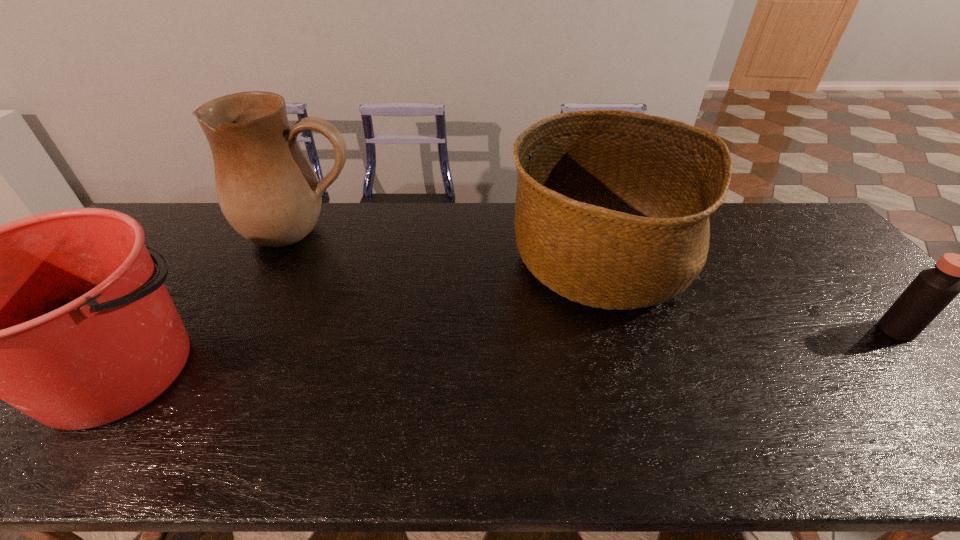
Where is `vacant region at the far edge`? This screenshot has height=540, width=960. vacant region at the far edge is located at coordinates (511, 207).

Find the location of a particular element. vacant space at the near edge of the desktop is located at coordinates (833, 439).

Where is `free space at the right edge of the desktop`? free space at the right edge of the desktop is located at coordinates (952, 403).

Identify which object is the closest to the shortest object. Please provide its 2D coordinates. Your answer should be formatted as a tuple, i.e. [(x, y)], where the tuple contains the x and y coordinates of a point satisfying the conditions above.

[(612, 208)]

Select which object is the second closest to the cream pitcher. Please provide its 2D coordinates. Your answer should be formatted as a tuple, i.e. [(x, y)], where the tuple contains the x and y coordinates of a point satisfying the conditions above.

[(612, 208)]

At what (x,y) coordinates should I click in order to perform the action: click on free space that satisfies the following two spatial constraints: 1. at the spout of the cream pitcher; 2. on the left side of the basket. Please return your answer as a coordinate pair (x, y). Looking at the image, I should click on (288, 261).

Find the location of a particular element. The width and height of the screenshot is (960, 540). free space in the image that satisfies the following two spatial constraints: 1. at the spout of the vinegar; 2. on the left side of the cream pitcher is located at coordinates (252, 330).

What are the coordinates of `vacant space that satisfies the following two spatial constraints: 1. at the spout of the cream pitcher; 2. on the right side of the basket` in the screenshot? It's located at (288, 261).

Find the location of `free region that satisfies the following two spatial constraints: 1. at the spout of the second object from right to left; 2. on the right side of the cream pitcher`. free region that satisfies the following two spatial constraints: 1. at the spout of the second object from right to left; 2. on the right side of the cream pitcher is located at coordinates (288, 261).

Image resolution: width=960 pixels, height=540 pixels. In order to click on blank area in the image that satisfies the following two spatial constraints: 1. at the spout of the cream pitcher; 2. on the right side of the third object from left to right in this screenshot , I will do `click(288, 261)`.